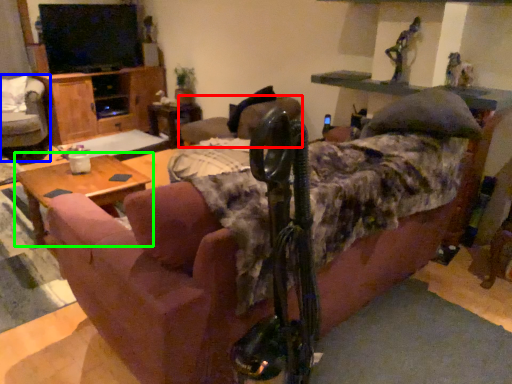
Question: Estimate the real-world distances between objects in this image. Which object is farther from chair (highlighted by a red box), chair (highlighted by a blue box) or table (highlighted by a green box)?

Choices:
 (A) chair
 (B) table

Answer: (A)